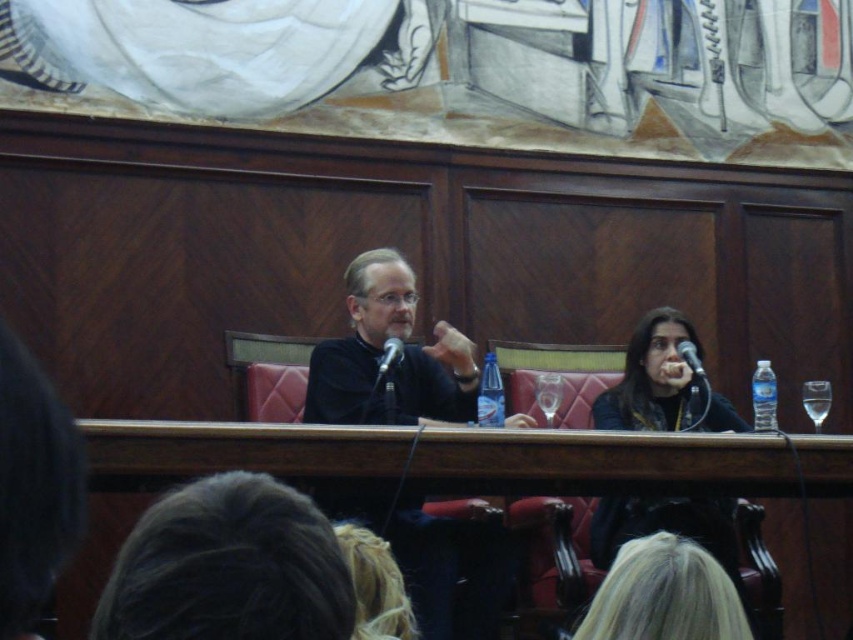
Between point (456, 332) and point (647, 577), which one is positioned in front?

Point (647, 577) is in front.

Is point (460, 413) positioned behind point (677, 611)?

Yes, it is.

Identify the location of matte black shirt at center. This screenshot has width=853, height=640. (381, 353).

Can you confirm if wooden table at center is thinner than black matte microphone at center?

In fact, wooden table at center might be wider than black matte microphone at center.

Find the location of a particular element. wooden table at center is located at coordinates (x=630, y=464).

Where is `wooden table at center`? Image resolution: width=853 pixels, height=640 pixels. wooden table at center is located at coordinates (630, 464).

From the picture: Is matte black shirt at center shorter than black plastic microphone at center?

In fact, matte black shirt at center may be taller than black plastic microphone at center.

In the scene shown: Between matte black shirt at center and black plastic microphone at center, which one appears on the left side from the viewer's perspective?

matte black shirt at center

Identify the location of matte black shirt at center. The height and width of the screenshot is (640, 853). (381, 353).

Find the location of `matte black shirt at center`. matte black shirt at center is located at coordinates 381,353.